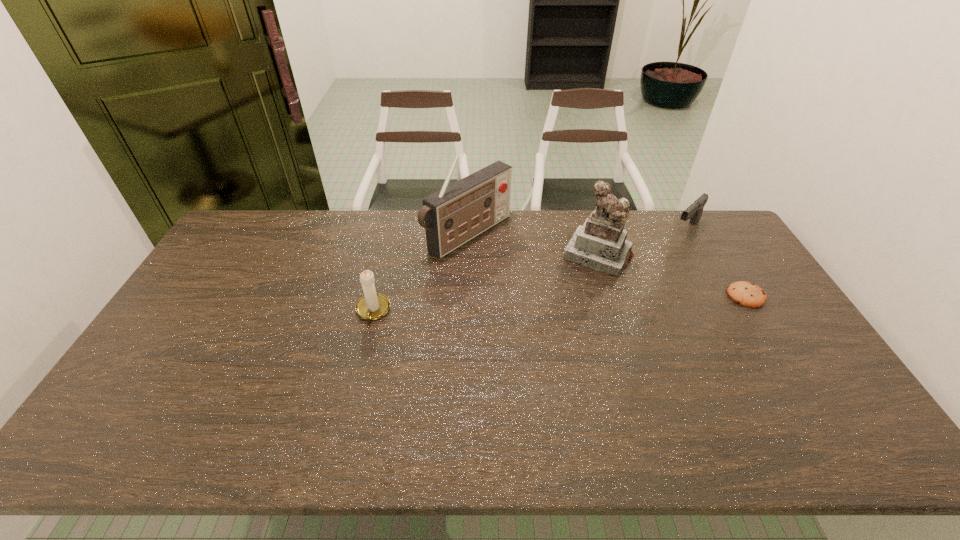
Identify the location of free location located aim along the barrel of the second shortest object. (646, 267).

At what (x,y) coordinates should I click in order to perform the action: click on vacant region located aim along the barrel of the second shortest object. Please return your answer as a coordinate pair (x, y). Looking at the image, I should click on (653, 260).

At what (x,y) coordinates should I click in order to perform the action: click on free space located 0.150m on the front panel of the fourth object from right to left. Please return your answer as a coordinate pair (x, y). Looking at the image, I should click on (533, 274).

This screenshot has height=540, width=960. I want to click on vacant position located 0.260m on the front panel of the fourth object from right to left, so click(x=560, y=291).

Locate an element on the screen. This screenshot has width=960, height=540. vacant space located on the front panel of the fourth object from right to left is located at coordinates (587, 307).

Identify the location of vacant region located on the front-facing side of the third object from left to right. (563, 311).

This screenshot has height=540, width=960. What are the coordinates of `vacant space located on the front-facing side of the third object from left to right` in the screenshot? It's located at tap(555, 325).

Locate an element on the screen. This screenshot has height=540, width=960. vacant space located on the front-facing side of the third object from left to right is located at coordinates (558, 320).

Find the location of a particular element. pistol that is at the far edge is located at coordinates (694, 212).

I want to click on radio receiver that is positioned at the far edge, so click(x=457, y=213).